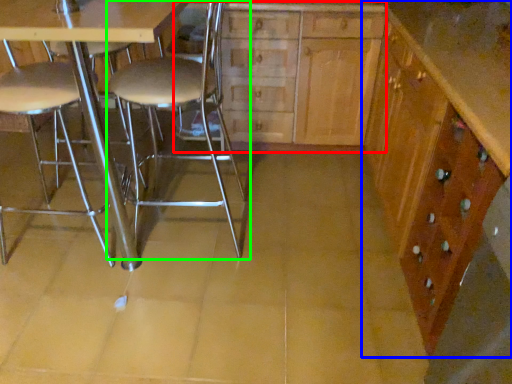
Question: Which object is positioned closest to dresser (highlighted by a red box)? Select from cabinetry (highlighted by a blue box) and chair (highlighted by a green box).

Choices:
 (A) cabinetry
 (B) chair

Answer: (B)